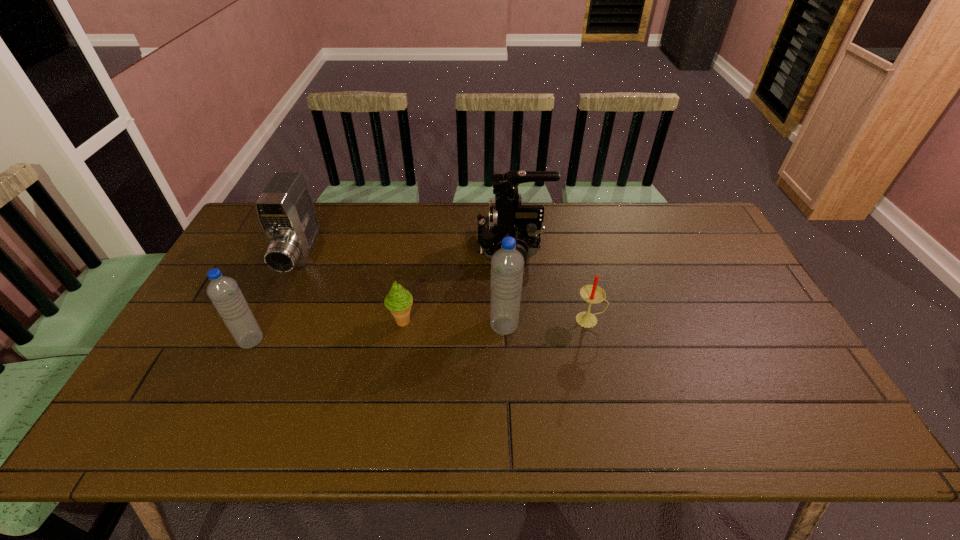
With all water bottles evenly spaced, where should an extra water bottle be placed on the right to continue the pattern? Please point out a vacant space. Please provide its 2D coordinates. Your answer should be formatted as a tuple, i.e. [(x, y)], where the tuple contains the x and y coordinates of a point satisfying the conditions above.

[(742, 312)]